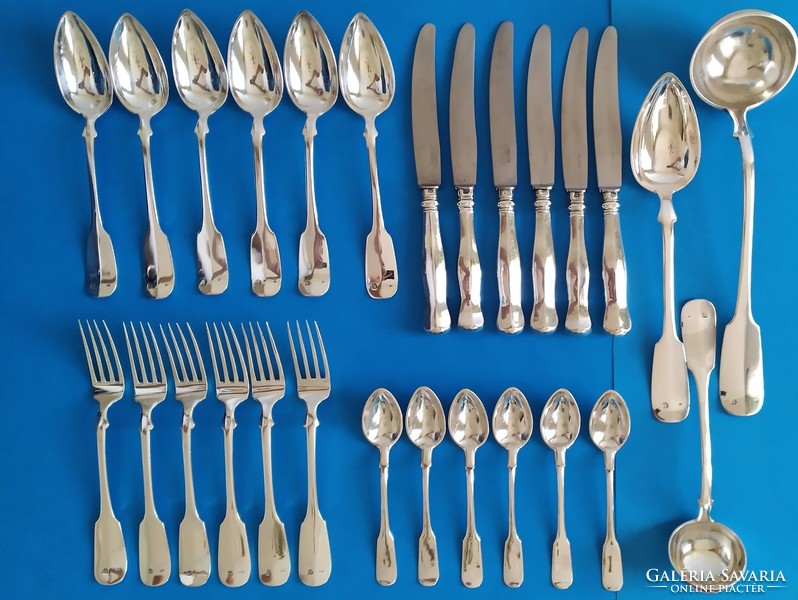
This screenshot has width=798, height=600. What are the coordinates of `teaspoons` in the screenshot? It's located at (382, 412), (417, 417), (468, 418), (506, 426), (550, 426), (619, 430).